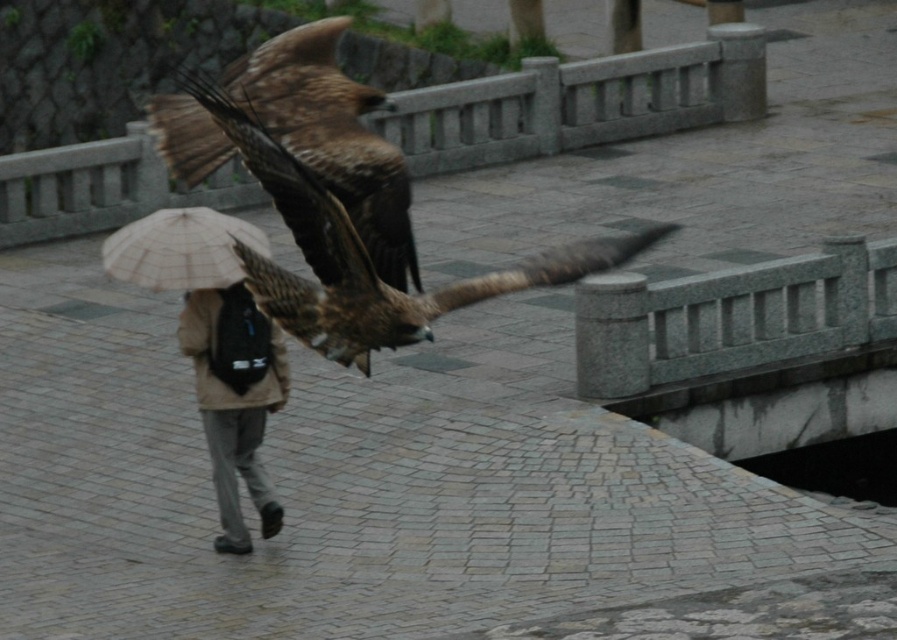
You are standing at the camera position and want to take a photo of the brown feathered eagle at center. If your camera has a maximum focus range of 15 meters, will you be able to capture the eagle clearly?

The brown feathered eagle at center is 14.17 meters away from the camera. Since the camera can focus up to 15 meters, you can capture the eagle clearly within the focus range.

You are standing in a park and see the brown feathered falcon at upper center. If you want to take a photo of it with your phone, which has a maximum focus range of 15 meters, will you be able to capture it clearly?

The brown feathered falcon at upper center is 14.76 meters away from the viewer. Since your phone can focus up to 15 meters, you can capture it clearly within the focus range.

You are a photographer trying to capture the brown feathered falcon at upper center and the beige fabric umbrella at center in a single shot. Given that your camera can only focus on objects wider than 30 cm, can both objects meet the focus requirement?

The brown feathered falcon at upper center is larger in width than the beige fabric umbrella at center. Since the falcon is wider than the umbrella, and assuming the umbrella meets the 30 cm requirement, both objects likely meet the focus requirement. However, if the umbrella is smaller than 30 cm, only the falcon would qualify.